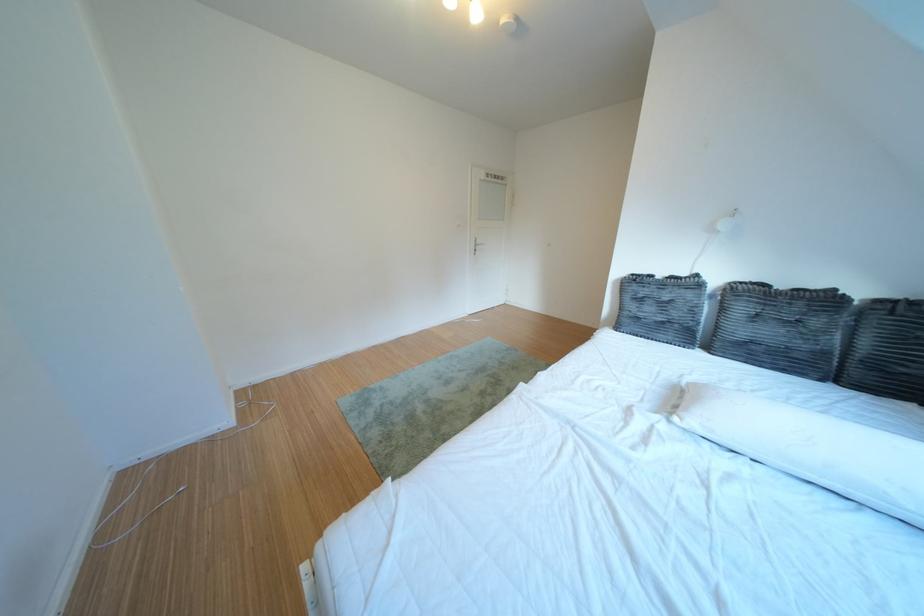
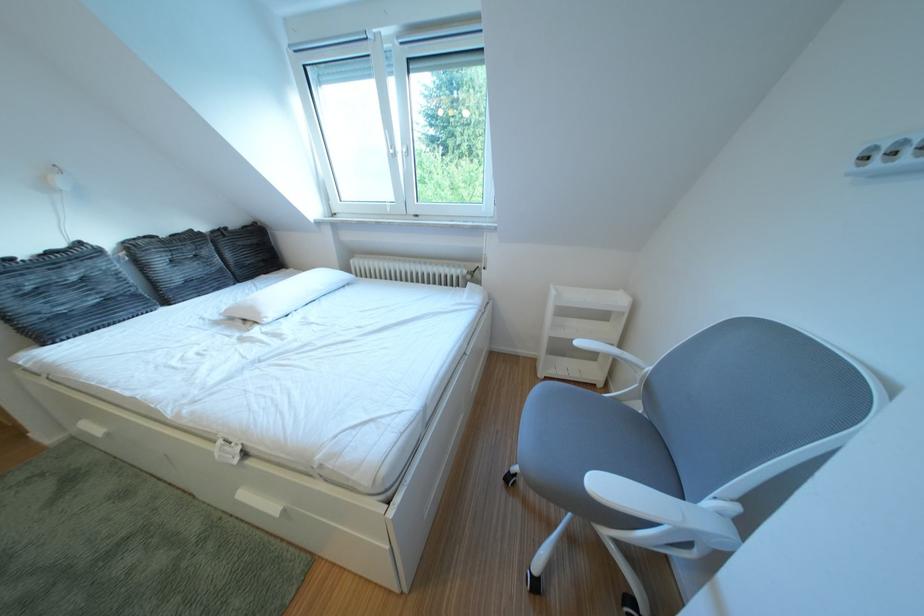
The point at (796,291) is marked in the first image. Where is the corresponding point in the second image?

(176, 240)